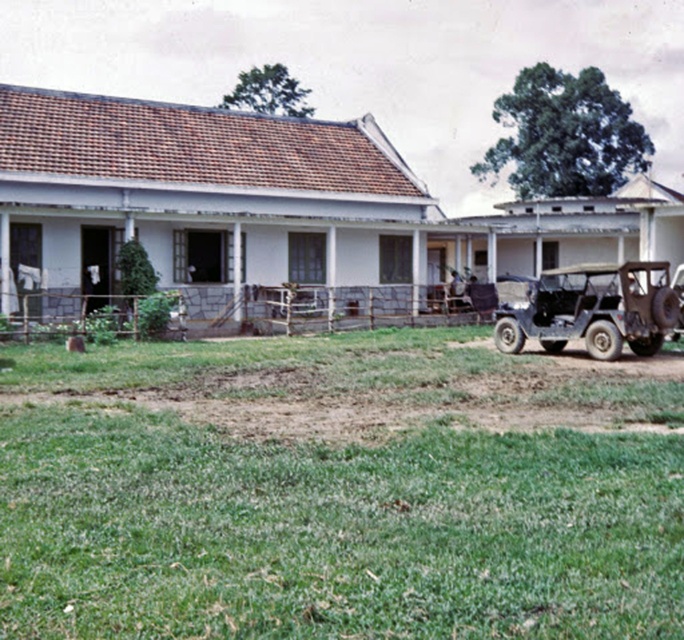
You are a gardener who needs to mow the lawn. The rusty metal jeep at right is blocking access to the green grass lawn at lower center. Can you move the jeep to the side to mow the lawn?

The green grass lawn at lower center has a greater height compared to rusty metal jeep at right, so the gardener can move the rusty metal jeep at right to the side to mow the lawn since the lawn is taller and needs maintenance.

You are planning to park a new compact car that is 1.8 meters wide in this scene. The green grass lawn at lower center and the green matte jeep at lower right are both in your view. Can the compact car fit between them without overlapping either?

The green grass lawn at lower center is wider than the green matte jeep at lower right. Since the lawn is wider, there might be enough space, but the exact width of the path between them isn